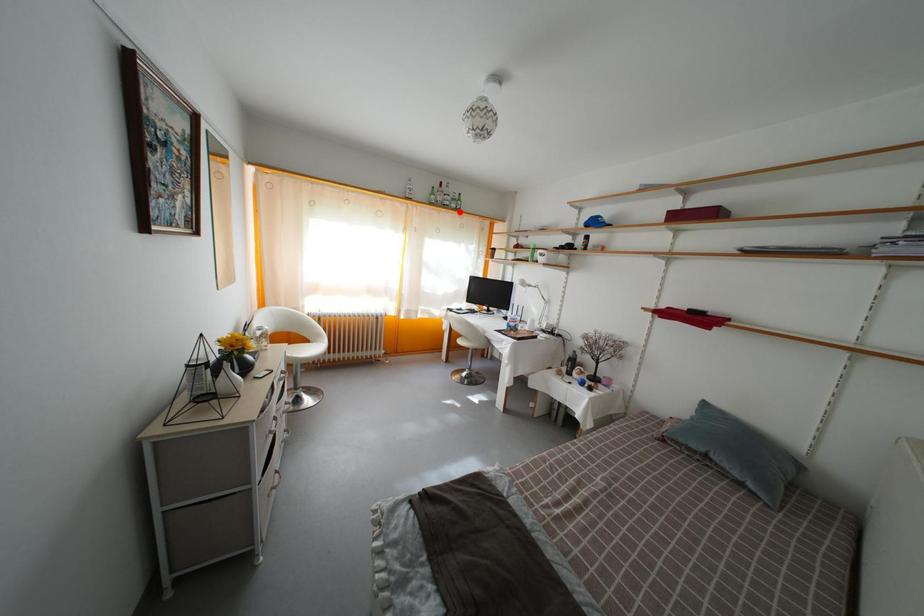
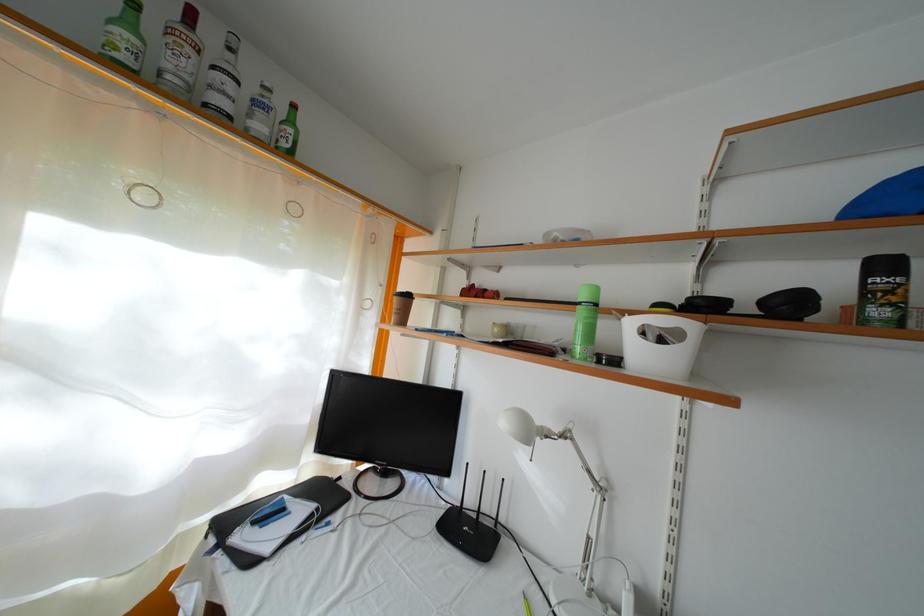
In the second image, find the point that corresponds to the highlighted location in the first image.

(264, 134)